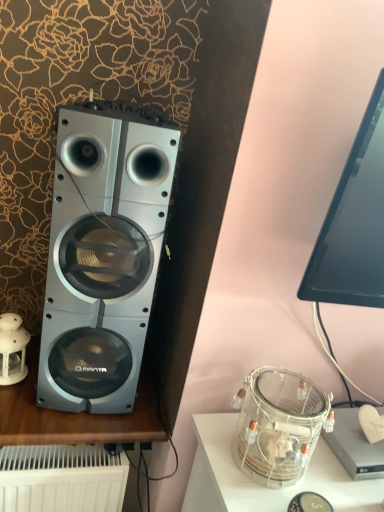
The image size is (384, 512). What are the coordinates of `free space to the right of clear glass jar at lower right` in the screenshot? It's located at (338, 481).